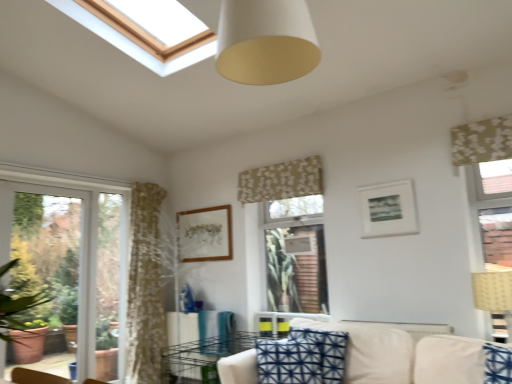
The width and height of the screenshot is (512, 384). Describe the element at coordinates (404, 355) in the screenshot. I see `beige fabric couch at lower center` at that location.

The height and width of the screenshot is (384, 512). Describe the element at coordinates (205, 234) in the screenshot. I see `wooden picture frame at center, the first picture frame positioned from the left` at that location.

Image resolution: width=512 pixels, height=384 pixels. What do you see at coordinates (482, 141) in the screenshot?
I see `green floral fabric curtain at upper right, which is the 2th curtain from back to front` at bounding box center [482, 141].

You are a GUI agent. You are given a task and a screenshot of the screen. Output one action in this format:
    pyautogui.click(x=<x>, y=<y>)
    Task: Click on the beige woven lampshade at right
    Image resolution: width=512 pixels, height=384 pixels.
    Given the screenshot: What is the action you would take?
    pyautogui.click(x=494, y=295)

From the image's perspective, is white matte cone at upper center positioned above or below wooden picture frame at center, placed as the 2th picture frame when sorted from front to back?

white matte cone at upper center is above wooden picture frame at center, placed as the 2th picture frame when sorted from front to back.

Does white matte cone at upper center turn towards wooden picture frame at center, placed as the 2th picture frame when sorted from front to back?

No, white matte cone at upper center is not oriented towards wooden picture frame at center, placed as the 2th picture frame when sorted from front to back.

From their relative heights in the image, would you say white matte cone at upper center is taller or shorter than wooden picture frame at center, positioned as the second picture frame in right-to-left order?

white matte cone at upper center is taller than wooden picture frame at center, positioned as the second picture frame in right-to-left order.

Could you measure the distance between white matte cone at upper center and wooden picture frame at center, the first picture frame positioned from the left?

They are 7.14 feet apart.

Does point (286, 198) appear closer or farther from the camera than point (59, 291)?

Point (286, 198).

Considering the sizes of floral fabric curtain at center, positioned as the second curtain in right-to-left order, and white glass window at left in the image, is floral fabric curtain at center, positioned as the second curtain in right-to-left order, taller or shorter than white glass window at left?

floral fabric curtain at center, positioned as the second curtain in right-to-left order, is shorter than white glass window at left.

In terms of width, does floral fabric curtain at center, which is the first curtain from left to right, look wider or thinner when compared to white glass window at left?

Clearly, floral fabric curtain at center, which is the first curtain from left to right, has more width compared to white glass window at left.

Does white glass window at left touch wooden picture frame at center, the first picture frame positioned from the left?

No, white glass window at left is not beside wooden picture frame at center, the first picture frame positioned from the left.

Which of these two, white glass window at left or wooden picture frame at center, positioned as the second picture frame in right-to-left order, is bigger?

white glass window at left.

From a real-world perspective, is white glass window at left above or below wooden picture frame at center, positioned as the second picture frame in right-to-left order?

From a real-world perspective, white glass window at left is physically below wooden picture frame at center, positioned as the second picture frame in right-to-left order.

Is beige woven lampshade at right not close to metallic wire rack at lower center?

Indeed, beige woven lampshade at right is not near metallic wire rack at lower center.

Considering the relative sizes of beige woven lampshade at right and metallic wire rack at lower center in the image provided, is beige woven lampshade at right thinner than metallic wire rack at lower center?

Yes.

Based on the photo, is beige woven lampshade at right shorter than metallic wire rack at lower center?

No, beige woven lampshade at right is not shorter than metallic wire rack at lower center.

From the image's perspective, which is above, beige woven lampshade at right or metallic wire rack at lower center?

beige woven lampshade at right is shown above in the image.

Is floral fabric curtain at center, the 2th curtain when ordered from front to back, aimed at metallic wire rack at lower center?

No, floral fabric curtain at center, the 2th curtain when ordered from front to back, is not facing towards metallic wire rack at lower center.

Which of these two, floral fabric curtain at center, which appears as the first curtain when viewed from the back, or metallic wire rack at lower center, is bigger?

With larger size is metallic wire rack at lower center.

Based on the photo, which of these two, floral fabric curtain at center, the 2th curtain when ordered from front to back, or metallic wire rack at lower center, is thinner?

floral fabric curtain at center, the 2th curtain when ordered from front to back, is thinner.

Looking at this image, is floral fabric curtain at center, positioned as the second curtain in right-to-left order, far from metallic wire rack at lower center?

Indeed, floral fabric curtain at center, positioned as the second curtain in right-to-left order, is not near metallic wire rack at lower center.

From the image's perspective, is beige woven lampshade at right on top of green floral fabric curtain at upper right, the first curtain viewed from the front?

No.

Is beige woven lampshade at right facing towards green floral fabric curtain at upper right, the first curtain viewed from the front?

No, beige woven lampshade at right does not turn towards green floral fabric curtain at upper right, the first curtain viewed from the front.

Based on the photo, who is more distant, beige woven lampshade at right or green floral fabric curtain at upper right, which is the 2th curtain from back to front?

green floral fabric curtain at upper right, which is the 2th curtain from back to front.

From the beige woven lampshade at right, count the 1st curtain to the left and point to it. Please provide its 2D coordinates.

[(482, 141)]

Where is `fixture that is in front of the white matte picture frame at upper right, acting as the first picture frame starting from the right`? fixture that is in front of the white matte picture frame at upper right, acting as the first picture frame starting from the right is located at coordinates (266, 41).

Would you say white matte cone at upper center is a long distance from white matte picture frame at upper right, which is the 1th picture frame in front-to-back order?

Yes, white matte cone at upper center and white matte picture frame at upper right, which is the 1th picture frame in front-to-back order, are quite far apart.

Which is more to the left, white matte cone at upper center or white matte picture frame at upper right, acting as the first picture frame starting from the right?

Positioned to the left is white matte cone at upper center.

Based on the photo, considering their positions, is white matte cone at upper center located in front of or behind white matte picture frame at upper right, which is the 1th picture frame in front-to-back order?

Visually, white matte cone at upper center is located in front of white matte picture frame at upper right, which is the 1th picture frame in front-to-back order.

There is a wooden picture frame at center, placed as the 2th picture frame when sorted from front to back. Where is `fixture above it (from a real-world perspective)`? The width and height of the screenshot is (512, 384). fixture above it (from a real-world perspective) is located at coordinates (266, 41).

From the white glass window at left, count 1st curtain to the right and point to it. Please provide its 2D coordinates.

[(281, 181)]

Looking at the image, which one is located closer to white glass window at left, white matte picture frame at upper right, acting as the 2th picture frame starting from the left, or blue printed cushion at center?

Based on the image, blue printed cushion at center appears to be nearer to white glass window at left.

From the image, which object appears to be nearer to metallic wire rack at lower center, white matte cone at upper center or wooden picture frame at center, the first picture frame positioned from the left?

wooden picture frame at center, the first picture frame positioned from the left, is positioned closer to the anchor metallic wire rack at lower center.

Based on their spatial positions, is white glass window at left or white matte picture frame at upper right, acting as the 2th picture frame starting from the back, further from green floral fabric curtain at upper right, the second curtain when ordered from left to right?

white glass window at left.

Considering their positions, is white matte cone at upper center positioned further to white matte picture frame at upper right, acting as the 2th picture frame starting from the left, than blue printed cushion at center?

white matte cone at upper center is positioned further to the anchor white matte picture frame at upper right, acting as the 2th picture frame starting from the left.

Estimate the real-world distances between objects in this image. Which object is closer to white matte cone at upper center, white glass window at left or white matte picture frame at upper right, acting as the first picture frame starting from the right?

white matte picture frame at upper right, acting as the first picture frame starting from the right, is closer to white matte cone at upper center.

From the image, which object appears to be nearer to wooden picture frame at center, placed as the 2th picture frame when sorted from front to back, white matte cone at upper center or green floral fabric curtain at upper right, the first curtain viewed from the front?

white matte cone at upper center.

When comparing their distances from white matte picture frame at upper right, acting as the first picture frame starting from the right, does white glass window at left or floral fabric curtain at center, the 2th curtain when ordered from front to back, seem closer?

floral fabric curtain at center, the 2th curtain when ordered from front to back, is closer to white matte picture frame at upper right, acting as the first picture frame starting from the right.

When comparing their distances from white matte picture frame at upper right, which is the 1th picture frame in front-to-back order, does white matte cone at upper center or metallic wire rack at lower center seem further?

metallic wire rack at lower center.

Find the location of `curtain located between white glass window at left and white matte picture frame at upper right, acting as the 2th picture frame starting from the left, in the left-right direction`. curtain located between white glass window at left and white matte picture frame at upper right, acting as the 2th picture frame starting from the left, in the left-right direction is located at coordinates (281, 181).

Where is `studio couch between white matte cone at upper center and blue printed cushion at center from top to bottom`? This screenshot has width=512, height=384. studio couch between white matte cone at upper center and blue printed cushion at center from top to bottom is located at coordinates (404, 355).

This screenshot has height=384, width=512. I want to click on picture frame located between white matte cone at upper center and floral fabric curtain at center, the 2th curtain when ordered from front to back, in the depth direction, so click(388, 209).

Locate an element on the screen. table lamp between green floral fabric curtain at upper right, the first curtain when ordered from right to left, and beige fabric couch at lower center vertically is located at coordinates (494, 295).